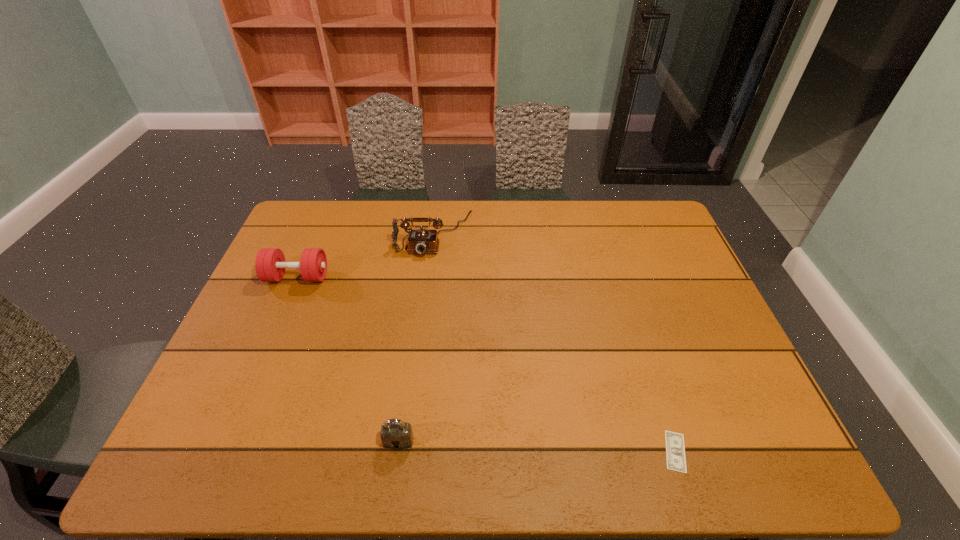
Identify the location of the tallest object. Image resolution: width=960 pixels, height=540 pixels. (421, 241).

The width and height of the screenshot is (960, 540). I want to click on the farthest object, so (x=421, y=241).

The height and width of the screenshot is (540, 960). Identify the location of the leftmost object. (270, 265).

The width and height of the screenshot is (960, 540). What are the coordinates of `dumbbell` in the screenshot? It's located at (270, 265).

You are a GUI agent. You are given a task and a screenshot of the screen. Output one action in this format:
    pyautogui.click(x=<x>, y=<y>)
    Task: Click on the padlock
    The height and width of the screenshot is (540, 960).
    Given the screenshot: What is the action you would take?
    pyautogui.click(x=395, y=434)

Where is `the rightmost object`? This screenshot has height=540, width=960. the rightmost object is located at coordinates (675, 451).

Identify the location of money. (675, 451).

At what (x,y) coordinates should I click in order to perform the action: click on vacant region located 0.200m on the dial of the tallest object. Please return your answer as a coordinate pair (x, y). Image resolution: width=960 pixels, height=540 pixels. Looking at the image, I should click on (424, 306).

The width and height of the screenshot is (960, 540). Identify the location of vacant space located 0.120m on the right of the leftmost object. (367, 277).

Identify the location of vacant space located on the left of the money. (507, 451).